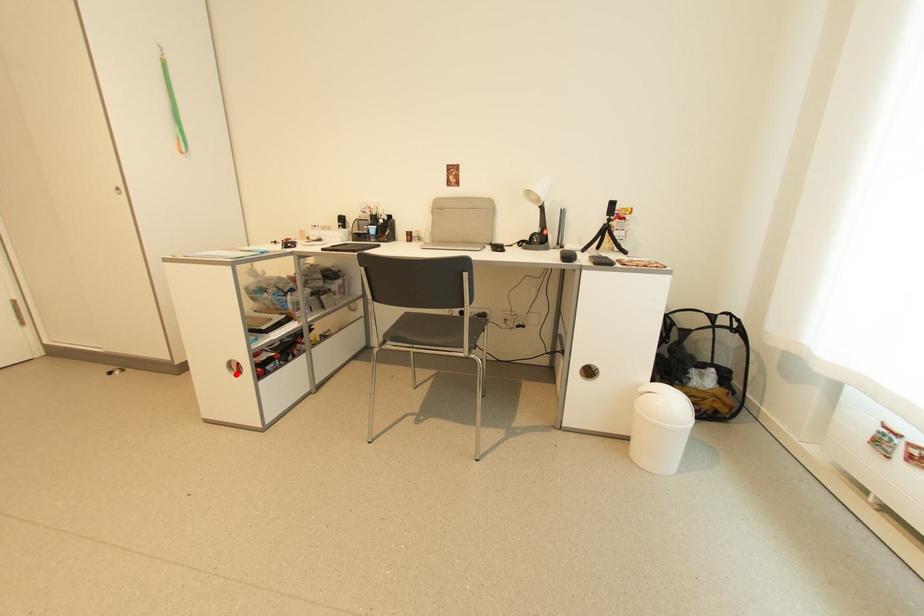
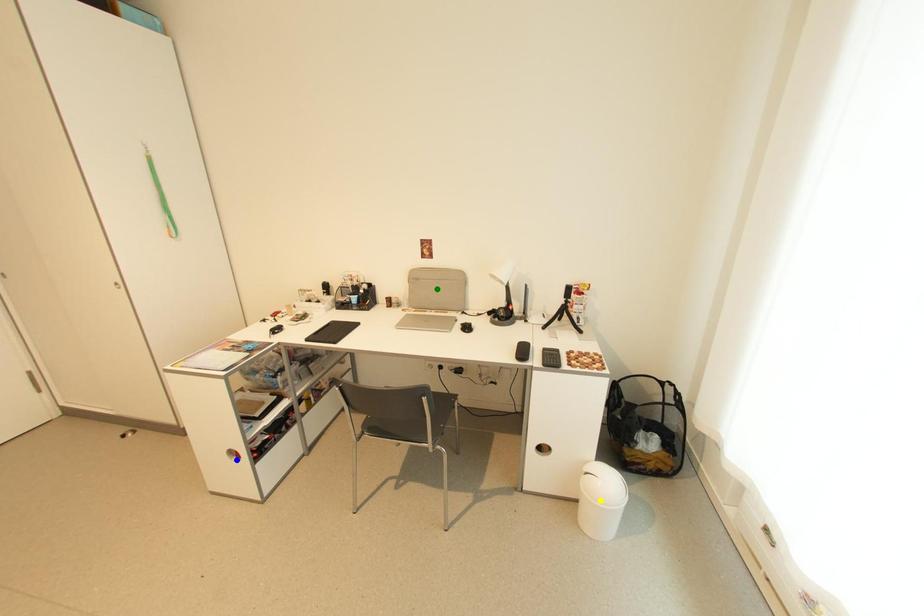
Question: I am providing you with two images of the same scene from different viewpoints. A red point is marked on the first image. You are given multiple points on the second image. In image 2, which mark is for the same physical point as the one in image 1?

Choices:
 (A) green point
 (B) yellow point
 (C) blue point

Answer: (C)